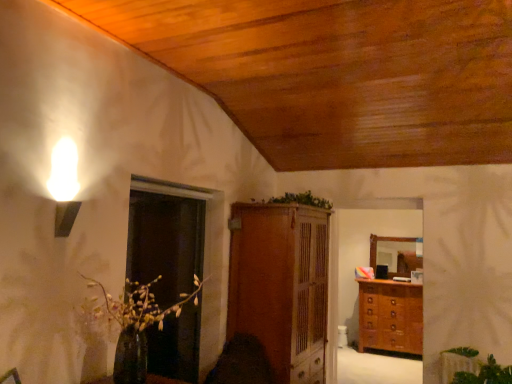
Question: From the image's perspective, is green leafy plant at lower right, the first plant when ordered from bottom to top, below transparent glass door at center?

Choices:
 (A) yes
 (B) no

Answer: (A)

Question: Is green leafy plant at lower right, the 2th plant positioned from the top, beside transparent glass door at center?

Choices:
 (A) no
 (B) yes

Answer: (A)

Question: Does green leafy plant at lower right, the 2th plant positioned from the top, have a smaller size compared to transparent glass door at center?

Choices:
 (A) no
 (B) yes

Answer: (A)

Question: Is green leafy plant at lower right, the 2th plant positioned from the top, oriented towards transparent glass door at center?

Choices:
 (A) yes
 (B) no

Answer: (B)

Question: Does green leafy plant at lower right, marked as the 2th plant in a back-to-front arrangement, have a greater width compared to transparent glass door at center?

Choices:
 (A) no
 (B) yes

Answer: (B)

Question: From the image's perspective, is green leafy plant at lower right, marked as the 2th plant in a back-to-front arrangement, on transparent glass door at center?

Choices:
 (A) no
 (B) yes

Answer: (A)

Question: Is green leafy plant at lower right, which is the second plant in left-to-right order, shorter than wooden chest of drawers at right?

Choices:
 (A) no
 (B) yes

Answer: (B)

Question: Is the depth of green leafy plant at lower right, which is the second plant in left-to-right order, greater than that of wooden chest of drawers at right?

Choices:
 (A) yes
 (B) no

Answer: (B)

Question: From a real-world perspective, does green leafy plant at lower right, placed as the 1th plant when sorted from front to back, stand above wooden chest of drawers at right?

Choices:
 (A) yes
 (B) no

Answer: (A)

Question: Considering the relative sizes of green leafy plant at lower right, the 2th plant positioned from the top, and wooden chest of drawers at right in the image provided, is green leafy plant at lower right, the 2th plant positioned from the top, taller than wooden chest of drawers at right?

Choices:
 (A) no
 (B) yes

Answer: (A)

Question: Considering the relative sizes of green leafy plant at lower right, the 2th plant positioned from the top, and wooden chest of drawers at right in the image provided, is green leafy plant at lower right, the 2th plant positioned from the top, smaller than wooden chest of drawers at right?

Choices:
 (A) yes
 (B) no

Answer: (A)

Question: From the image's perspective, is green leafy plant at lower right, marked as the 2th plant in a back-to-front arrangement, on wooden chest of drawers at right?

Choices:
 (A) yes
 (B) no

Answer: (A)

Question: Considering the relative sizes of green leafy plant at center, the first plant when ordered from left to right, and transparent glass door at center in the image provided, is green leafy plant at center, the first plant when ordered from left to right, bigger than transparent glass door at center?

Choices:
 (A) yes
 (B) no

Answer: (B)